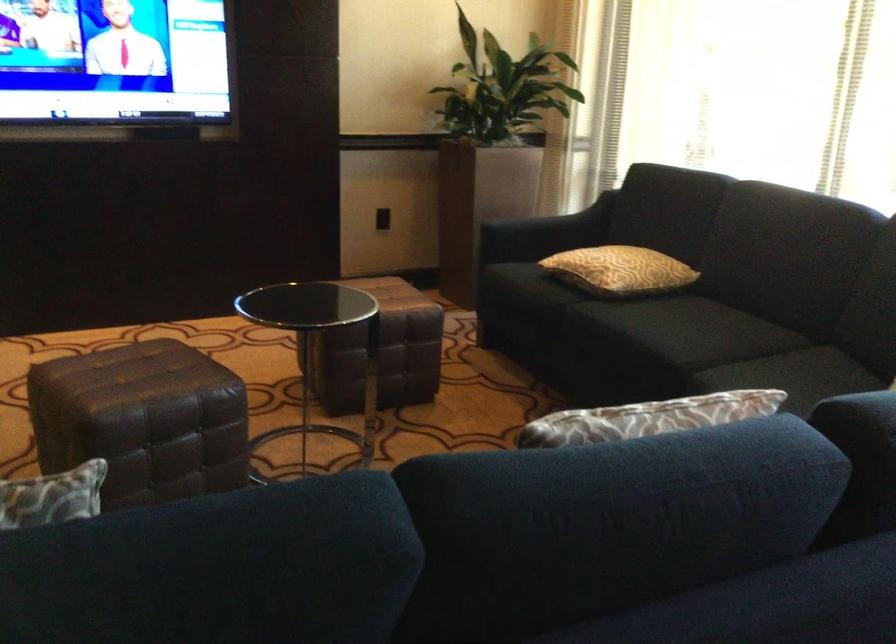
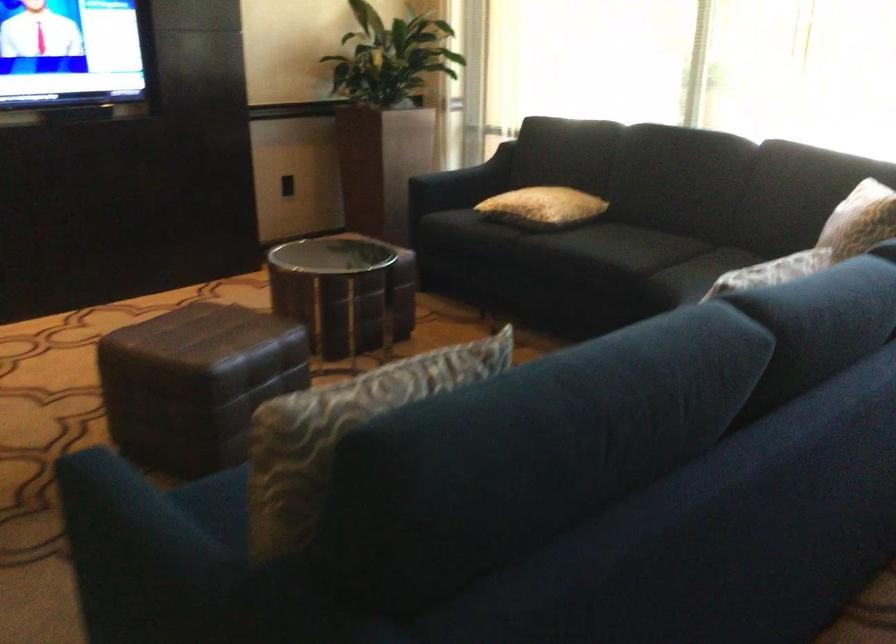
Where in the second image is the point corresponding to the point at 676,342 from the first image?

(626, 254)